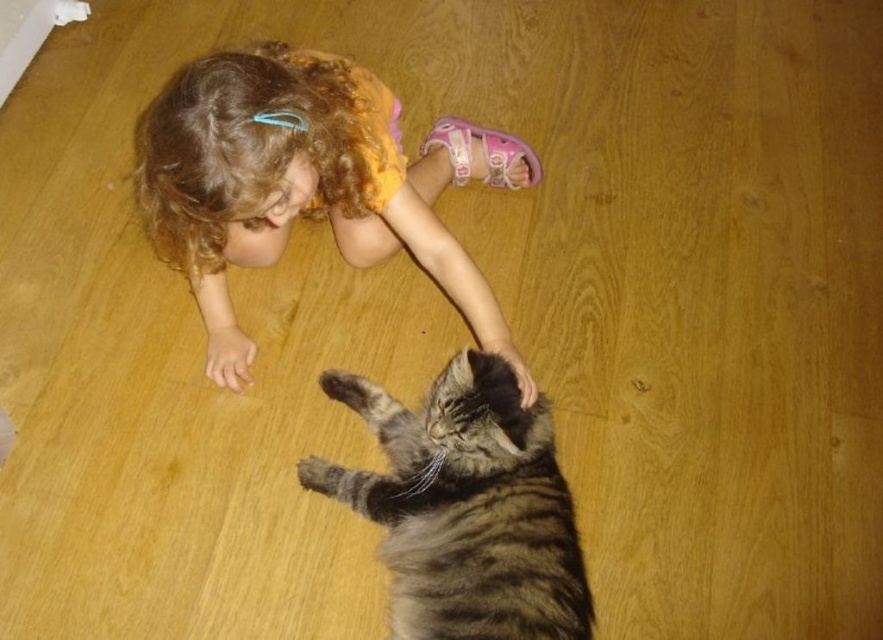
Question: Can you confirm if curly blonde hair at upper left is positioned to the right of striped fur cat at lower center?

Choices:
 (A) yes
 (B) no

Answer: (B)

Question: Is curly blonde hair at upper left above striped fur cat at lower center?

Choices:
 (A) no
 (B) yes

Answer: (B)

Question: Among these objects, which one is farthest from the camera?

Choices:
 (A) striped fur cat at lower center
 (B) curly blonde hair at upper left

Answer: (A)

Question: Is curly blonde hair at upper left smaller than striped fur cat at lower center?

Choices:
 (A) no
 (B) yes

Answer: (A)

Question: Among these points, which one is nearest to the camera?

Choices:
 (A) (266, 244)
 (B) (555, 474)

Answer: (B)

Question: Which of the following is the closest to the observer?

Choices:
 (A) (446, 406)
 (B) (238, 378)

Answer: (A)